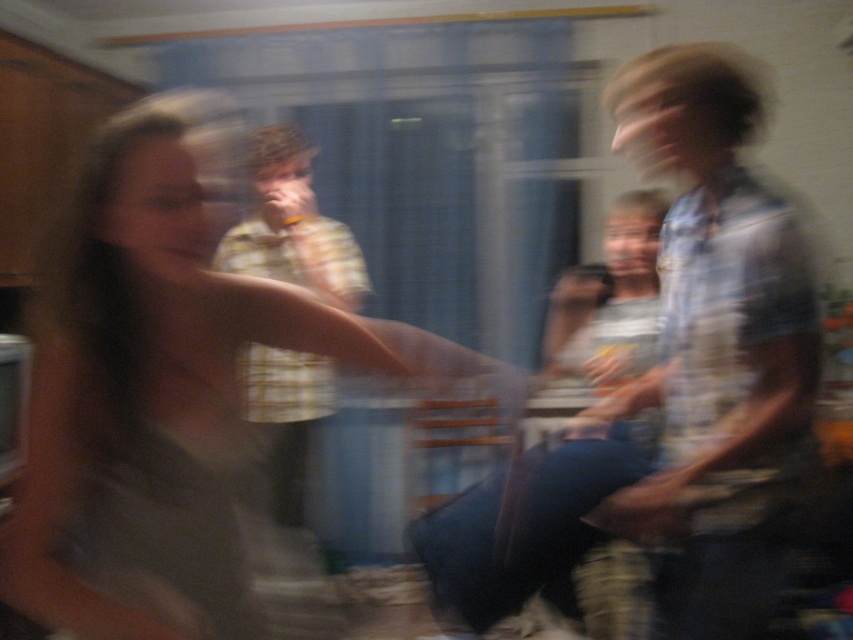
Question: Among these points, which one is farthest from the camera?

Choices:
 (A) (267, 161)
 (B) (91, 218)

Answer: (A)

Question: Is matte gray tank top at center further to camera compared to yellow plaid shirt at center?

Choices:
 (A) yes
 (B) no

Answer: (B)

Question: Which of the following is the closest to the observer?

Choices:
 (A) (664, 243)
 (B) (141, 236)
 (C) (252, 397)

Answer: (B)

Question: Is matte gray tank top at center to the left of yellow plaid shirt at center from the viewer's perspective?

Choices:
 (A) yes
 (B) no

Answer: (B)

Question: Is blue striped shirt at right to the left of yellow plaid shirt at center from the viewer's perspective?

Choices:
 (A) no
 (B) yes

Answer: (A)

Question: Which object is positioned farthest from the matte gray tank top at center?

Choices:
 (A) blue striped shirt at right
 (B) yellow plaid shirt at center

Answer: (B)